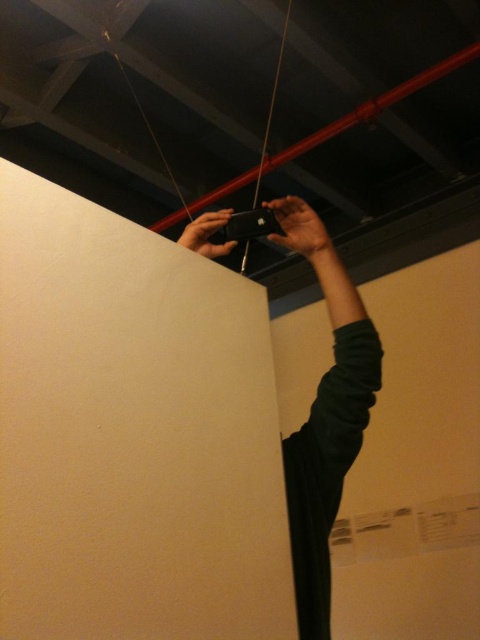
Based on the photo, you are standing in a room and want to take a photo with your camera. The camera is located at point (304, 253). If you need to be at least 4 feet away from the camera to avoid being in the frame, will you be in the photo?

The distance between you and the camera at point (304, 253) is 3.99 feet, which is less than the required 4 feet. Therefore, you will be in the photo.

You are holding a 2.5 feet long ladder and want to take a photo of the matte black phone at center. The ceiling has a red pipe and cables hanging from it. Can you safely extend the ladder vertically without hitting the ceiling obstacles?

The distance between the matte black phone at center and the viewer is 3.72 feet. Since the ladder is 2.5 feet long, when extended vertically, it would not reach the ceiling obstacles as the phone is within the ladder length. However, ensure the ladder is positioned to avoid the red pipe and cables above.